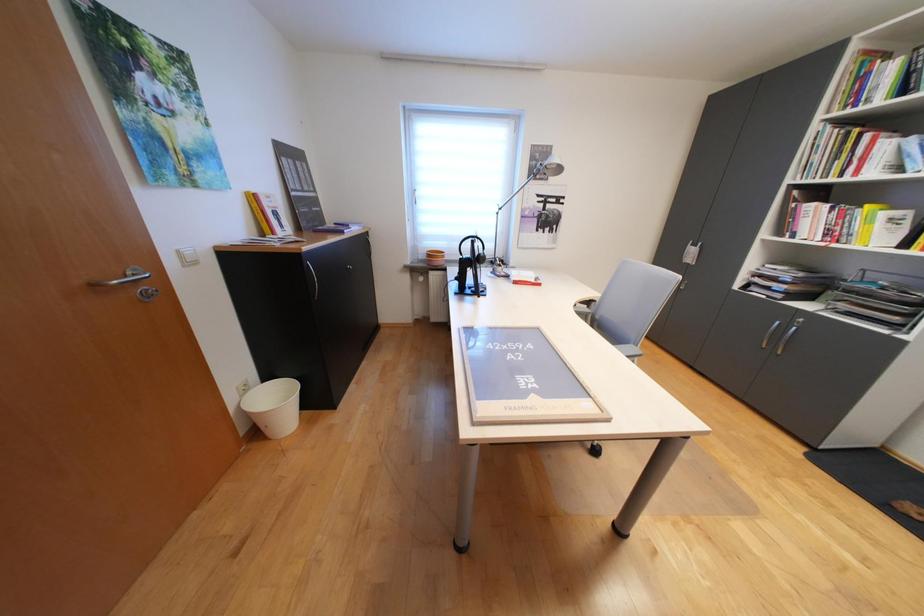
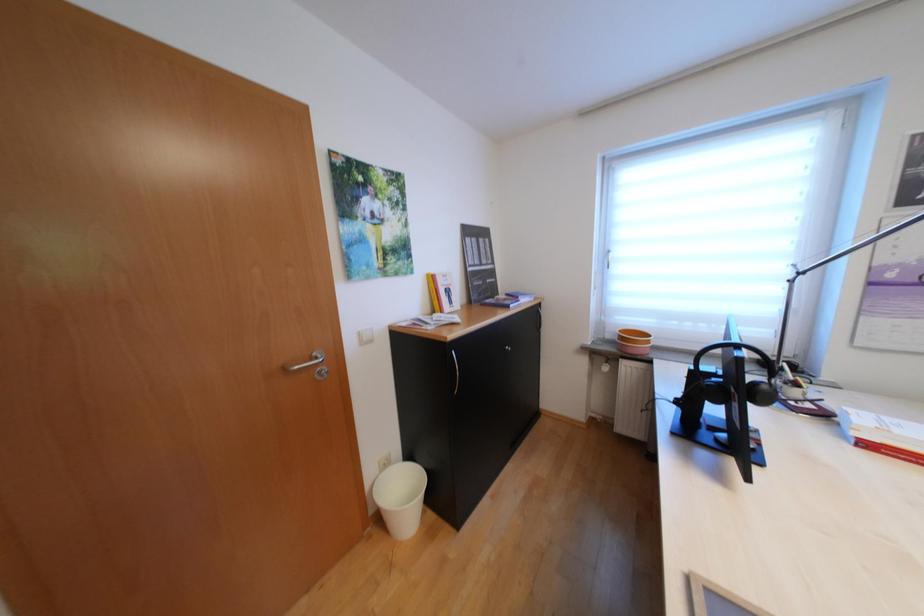
Question: How did the camera likely rotate?

Choices:
 (A) Left
 (B) Right
 (C) Up
 (D) Down

Answer: (A)